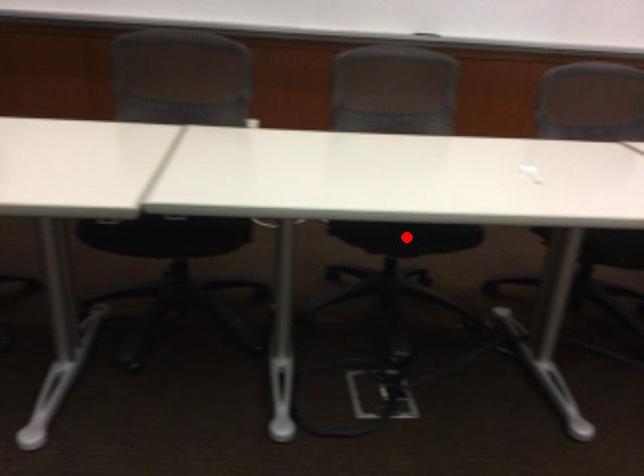
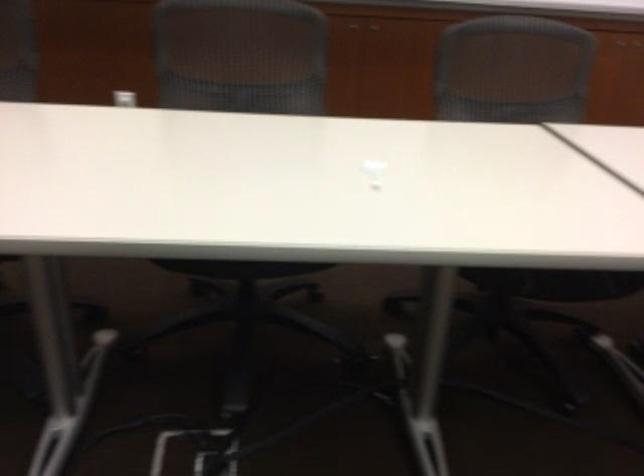
Question: I am providing you with two images of the same scene from different viewpoints. A red point is marked on the first image. Is the red point's position out of view in image 2?

Choices:
 (A) Yes
 (B) No

Answer: (A)